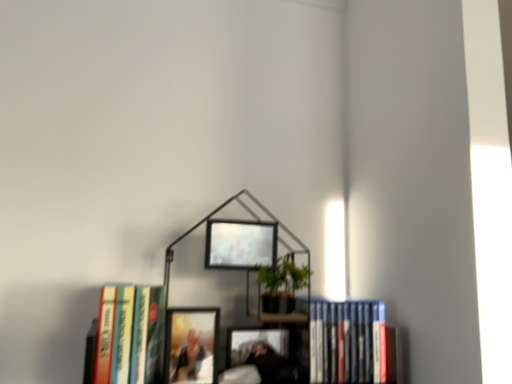
The image size is (512, 384). What do you see at coordinates (169, 317) in the screenshot?
I see `metallic black bookcase at center` at bounding box center [169, 317].

Locate an element on the screen. The image size is (512, 384). metallic silver picture frame at upper center, the 2th picture frame when ordered from left to right is located at coordinates (240, 244).

The image size is (512, 384). Find the location of `metallic black bookcase at center`. metallic black bookcase at center is located at coordinates (169, 317).

Considering their positions, is metallic black bookcase at center located in front of or behind hardcover book at left, arranged as the 2th book when viewed from the right?

metallic black bookcase at center is behind hardcover book at left, arranged as the 2th book when viewed from the right.

Looking at the image, does metallic black bookcase at center seem bigger or smaller compared to hardcover book at left, the first book in the left-to-right sequence?

Clearly, metallic black bookcase at center is larger in size than hardcover book at left, the first book in the left-to-right sequence.

Is metallic black bookcase at center facing away from hardcover book at left, the first book in the left-to-right sequence?

No.

Is point (124, 327) closer or farther from the camera than point (123, 300)?

Clearly, point (124, 327) is closer to the camera than point (123, 300).

Looking at the image, does matte wooden picture frame at center, arranged as the first picture frame when viewed from the left, seem bigger or smaller compared to metallic black bookcase at center?

Considering their sizes, matte wooden picture frame at center, arranged as the first picture frame when viewed from the left, takes up less space than metallic black bookcase at center.

Is matte wooden picture frame at center, which ranks as the second picture frame in top-to-bottom order, facing away from metallic black bookcase at center?

Absolutely, matte wooden picture frame at center, which ranks as the second picture frame in top-to-bottom order, is directed away from metallic black bookcase at center.

Considering the relative sizes of matte wooden picture frame at center, placed as the first picture frame when sorted from bottom to top, and metallic black bookcase at center in the image provided, is matte wooden picture frame at center, placed as the first picture frame when sorted from bottom to top, wider than metallic black bookcase at center?

In fact, matte wooden picture frame at center, placed as the first picture frame when sorted from bottom to top, might be narrower than metallic black bookcase at center.

Considering the positions of points (206, 361) and (353, 361), is point (206, 361) farther from camera compared to point (353, 361)?

No, it is in front of (353, 361).

Is blue hardcover book at lower right, which ranks as the first book in right-to-left order, facing towards hardcover book at left, arranged as the 2th book when viewed from the right?

No, blue hardcover book at lower right, which ranks as the first book in right-to-left order, does not turn towards hardcover book at left, arranged as the 2th book when viewed from the right.

Between blue hardcover book at lower right, the 2th book from the left, and hardcover book at left, arranged as the 2th book when viewed from the right, which one has more height?

hardcover book at left, arranged as the 2th book when viewed from the right, is taller.

Considering the sizes of objects blue hardcover book at lower right, the 2th book from the left, and hardcover book at left, arranged as the 2th book when viewed from the right, in the image provided, who is thinner, blue hardcover book at lower right, the 2th book from the left, or hardcover book at left, arranged as the 2th book when viewed from the right,?

With smaller width is blue hardcover book at lower right, the 2th book from the left.

Which is nearer, (354, 347) or (99, 357)?

Point (354, 347) appears to be farther away from the viewer than point (99, 357).

How different are the orientations of matte wooden picture frame at center, the second picture frame when ordered from right to left, and hardcover book at left, the first book in the left-to-right sequence, in degrees?

0.000297 degrees.

Is hardcover book at left, the first book in the left-to-right sequence, inside matte wooden picture frame at center, the second picture frame when ordered from right to left?

No, hardcover book at left, the first book in the left-to-right sequence, is located outside of matte wooden picture frame at center, the second picture frame when ordered from right to left.

From a real-world perspective, is matte wooden picture frame at center, arranged as the first picture frame when viewed from the left, physically located above or below hardcover book at left, the first book in the left-to-right sequence?

matte wooden picture frame at center, arranged as the first picture frame when viewed from the left, is below hardcover book at left, the first book in the left-to-right sequence.

Based on the photo, who is smaller, matte wooden picture frame at center, the second picture frame when ordered from right to left, or hardcover book at left, the first book in the left-to-right sequence?

Smaller between the two is matte wooden picture frame at center, the second picture frame when ordered from right to left.

Which of these two, metallic silver picture frame at upper center, the 1th picture frame from the top, or matte wooden picture frame at center, arranged as the first picture frame when viewed from the left, stands taller?

matte wooden picture frame at center, arranged as the first picture frame when viewed from the left.

Between metallic silver picture frame at upper center, which is counted as the 1th picture frame, starting from the right, and matte wooden picture frame at center, arranged as the first picture frame when viewed from the left, which one appears on the right side from the viewer's perspective?

Positioned to the right is metallic silver picture frame at upper center, which is counted as the 1th picture frame, starting from the right.

Would you say metallic silver picture frame at upper center, the 1th picture frame from the top, is a long distance from matte wooden picture frame at center, the second picture frame when ordered from right to left?

metallic silver picture frame at upper center, the 1th picture frame from the top, is actually quite close to matte wooden picture frame at center, the second picture frame when ordered from right to left.

Is metallic silver picture frame at upper center, the 2th picture frame when ordered from left to right, oriented away from matte wooden picture frame at center, arranged as the first picture frame when viewed from the left?

No, metallic silver picture frame at upper center, the 2th picture frame when ordered from left to right,'s orientation is not away from matte wooden picture frame at center, arranged as the first picture frame when viewed from the left.

Considering the sizes of metallic silver picture frame at upper center, the 1th picture frame from the top, and blue hardcover book at lower right, which ranks as the first book in right-to-left order, in the image, is metallic silver picture frame at upper center, the 1th picture frame from the top, bigger or smaller than blue hardcover book at lower right, which ranks as the first book in right-to-left order,?

In the image, metallic silver picture frame at upper center, the 1th picture frame from the top, appears to be smaller than blue hardcover book at lower right, which ranks as the first book in right-to-left order.

Considering the positions of objects metallic silver picture frame at upper center, the 1th picture frame from the top, and blue hardcover book at lower right, which ranks as the first book in right-to-left order, in the image provided, who is in front, metallic silver picture frame at upper center, the 1th picture frame from the top, or blue hardcover book at lower right, which ranks as the first book in right-to-left order,?

metallic silver picture frame at upper center, the 1th picture frame from the top, is more forward.

From a real-world perspective, relative to blue hardcover book at lower right, which ranks as the first book in right-to-left order, is metallic silver picture frame at upper center, which is counted as the 1th picture frame, starting from the right, vertically above or below?

Clearly, from a real-world perspective, metallic silver picture frame at upper center, which is counted as the 1th picture frame, starting from the right, is above blue hardcover book at lower right, which ranks as the first book in right-to-left order.

Which of these two, metallic silver picture frame at upper center, which is counted as the 1th picture frame, starting from the right, or blue hardcover book at lower right, which ranks as the first book in right-to-left order, stands taller?

blue hardcover book at lower right, which ranks as the first book in right-to-left order, is taller.

Is the position of metallic black bookcase at center less distant than that of blue hardcover book at lower right, the 2th book from the left?

Yes, metallic black bookcase at center is closer to the viewer.

Looking at this image, can you confirm if metallic black bookcase at center is shorter than blue hardcover book at lower right, the 2th book from the left?

No, metallic black bookcase at center is not shorter than blue hardcover book at lower right, the 2th book from the left.

Is metallic black bookcase at center touching blue hardcover book at lower right, which ranks as the first book in right-to-left order?

There is a gap between metallic black bookcase at center and blue hardcover book at lower right, which ranks as the first book in right-to-left order.

I want to click on book lying on the right of metallic black bookcase at center, so click(347, 342).

You are a GUI agent. You are given a task and a screenshot of the screen. Output one action in this format:
    pyautogui.click(x=<x>, y=<y>)
    Task: Click on the book in front of the metallic black bookcase at center
    This screenshot has width=512, height=384.
    Given the screenshot: What is the action you would take?
    pyautogui.click(x=128, y=335)

Find the location of a particular element. The height and width of the screenshot is (384, 512). bookcase to the right of matte wooden picture frame at center, the second picture frame when ordered from right to left is located at coordinates (169, 317).

Which object lies nearer to the anchor point hardcover book at left, arranged as the 2th book when viewed from the right, matte wooden picture frame at center, which ranks as the second picture frame in top-to-bottom order, or metallic silver picture frame at upper center, the 2th picture frame when ordered from left to right?

matte wooden picture frame at center, which ranks as the second picture frame in top-to-bottom order, is positioned closer to the anchor hardcover book at left, arranged as the 2th book when viewed from the right.

From the picture: Looking at the image, which one is located further to blue hardcover book at lower right, the 2th book from the left, metallic silver picture frame at upper center, the 1th picture frame from the top, or matte wooden picture frame at center, which ranks as the second picture frame in top-to-bottom order?

matte wooden picture frame at center, which ranks as the second picture frame in top-to-bottom order, is further to blue hardcover book at lower right, the 2th book from the left.

When comparing their distances from metallic silver picture frame at upper center, the 2th picture frame ordered from the bottom, does metallic black bookcase at center or matte wooden picture frame at center, which ranks as the second picture frame in top-to-bottom order, seem further?

matte wooden picture frame at center, which ranks as the second picture frame in top-to-bottom order, is further to metallic silver picture frame at upper center, the 2th picture frame ordered from the bottom.

Which object lies further to the anchor point blue hardcover book at lower right, the 2th book from the left, matte wooden picture frame at center, the second picture frame when ordered from right to left, or metallic silver picture frame at upper center, the 2th picture frame when ordered from left to right?

matte wooden picture frame at center, the second picture frame when ordered from right to left, lies further to blue hardcover book at lower right, the 2th book from the left, than the other object.

From the image, which object appears to be farther from metallic silver picture frame at upper center, the 2th picture frame ordered from the bottom, matte wooden picture frame at center, the second picture frame when ordered from right to left, or hardcover book at left, arranged as the 2th book when viewed from the right?

The object further to metallic silver picture frame at upper center, the 2th picture frame ordered from the bottom, is hardcover book at left, arranged as the 2th book when viewed from the right.

Which object lies further to the anchor point hardcover book at left, the first book in the left-to-right sequence, metallic silver picture frame at upper center, the 2th picture frame when ordered from left to right, or metallic black bookcase at center?

Among the two, metallic silver picture frame at upper center, the 2th picture frame when ordered from left to right, is located further to hardcover book at left, the first book in the left-to-right sequence.

Which object lies nearer to the anchor point metallic black bookcase at center, hardcover book at left, arranged as the 2th book when viewed from the right, or blue hardcover book at lower right, which ranks as the first book in right-to-left order?

blue hardcover book at lower right, which ranks as the first book in right-to-left order, lies closer to metallic black bookcase at center than the other object.

Estimate the real-world distances between objects in this image. Which object is further from metallic silver picture frame at upper center, the 2th picture frame when ordered from left to right, hardcover book at left, arranged as the 2th book when viewed from the right, or blue hardcover book at lower right, which ranks as the first book in right-to-left order?

blue hardcover book at lower right, which ranks as the first book in right-to-left order, is positioned further to the anchor metallic silver picture frame at upper center, the 2th picture frame when ordered from left to right.

You are a GUI agent. You are given a task and a screenshot of the screen. Output one action in this format:
    pyautogui.click(x=<x>, y=<y>)
    Task: Click on the picture frame between hardcover book at left, the first book in the left-to-right sequence, and metallic silver picture frame at upper center, which is counted as the 1th picture frame, starting from the right, from left to right
    This screenshot has height=384, width=512.
    Given the screenshot: What is the action you would take?
    pyautogui.click(x=191, y=345)

Where is `picture frame between hardcover book at left, the first book in the left-to-right sequence, and metallic black bookcase at center, in the horizontal direction`? The image size is (512, 384). picture frame between hardcover book at left, the first book in the left-to-right sequence, and metallic black bookcase at center, in the horizontal direction is located at coordinates click(191, 345).

Image resolution: width=512 pixels, height=384 pixels. I want to click on bookcase located between matte wooden picture frame at center, the second picture frame when ordered from right to left, and blue hardcover book at lower right, the 2th book from the left, in the left-right direction, so click(x=169, y=317).

Find the location of a particular element. This screenshot has height=384, width=512. bookcase between hardcover book at left, the first book in the left-to-right sequence, and metallic silver picture frame at upper center, which is counted as the 1th picture frame, starting from the right, in the horizontal direction is located at coordinates (169, 317).